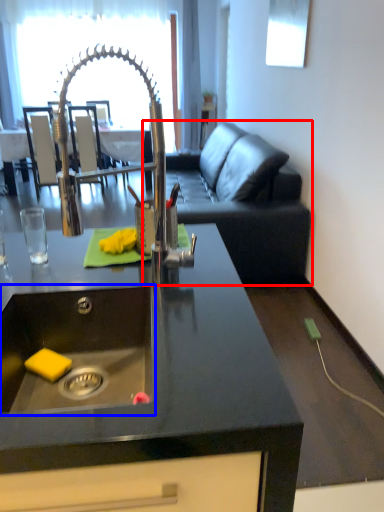
Question: Which of the following is the farthest to the observer, studio couch (highlighted by a red box) or sink (highlighted by a blue box)?

Choices:
 (A) studio couch
 (B) sink

Answer: (A)